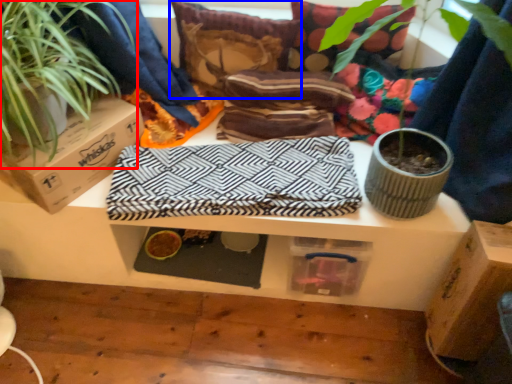
Question: Among these objects, which one is nearest to the camera, houseplant (highlighted by a red box) or pillow (highlighted by a blue box)?

Choices:
 (A) houseplant
 (B) pillow

Answer: (A)